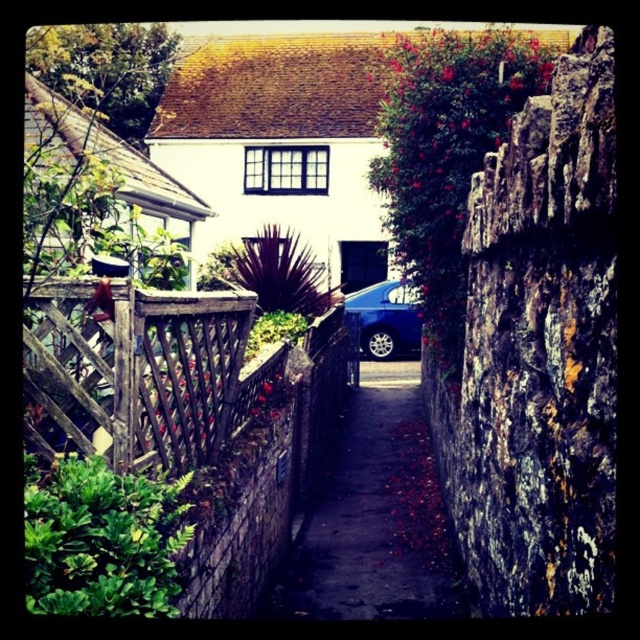
Question: Which of the following is the farthest from the observer?

Choices:
 (A) dark concrete driveway at center
 (B) white matte cottage at center

Answer: (B)

Question: Can you confirm if weathered wood fence at left is thinner than white matte cottage at center?

Choices:
 (A) no
 (B) yes

Answer: (B)

Question: Based on their relative distances, which object is nearer to the dark concrete driveway at center?

Choices:
 (A) weathered wood fence at left
 (B) white matte cottage at center
 (C) wooden lattice fence at center-left
 (D) white wooden cottage at upper center

Answer: (A)

Question: Which point is farther to the camera?

Choices:
 (A) white matte cottage at center
 (B) blue metallic car at center
 (C) wooden lattice fence at center-left
 (D) dark concrete driveway at center

Answer: (B)

Question: Is white matte cottage at center below wooden lattice fence at center-left?

Choices:
 (A) no
 (B) yes

Answer: (A)

Question: Does white matte cottage at center come in front of dark concrete driveway at center?

Choices:
 (A) yes
 (B) no

Answer: (B)